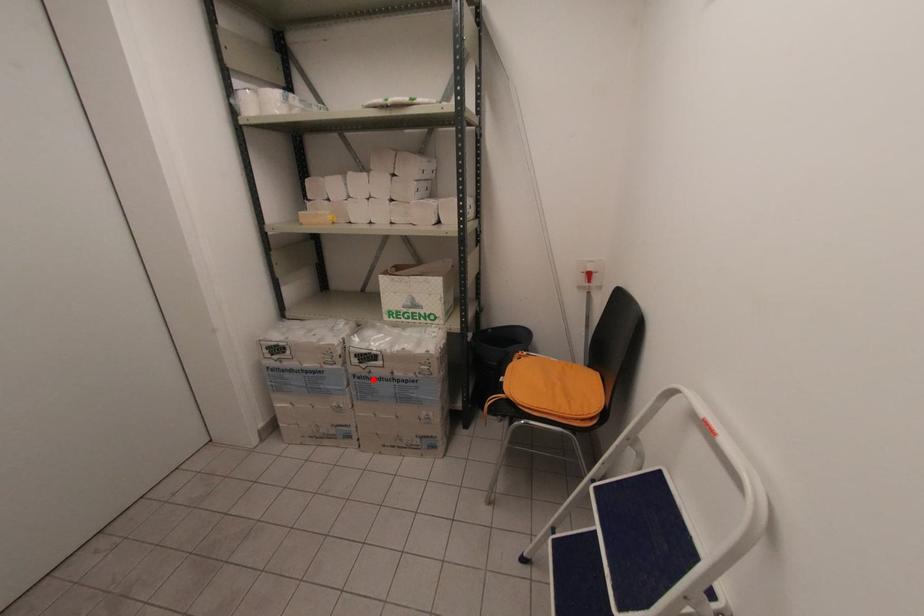
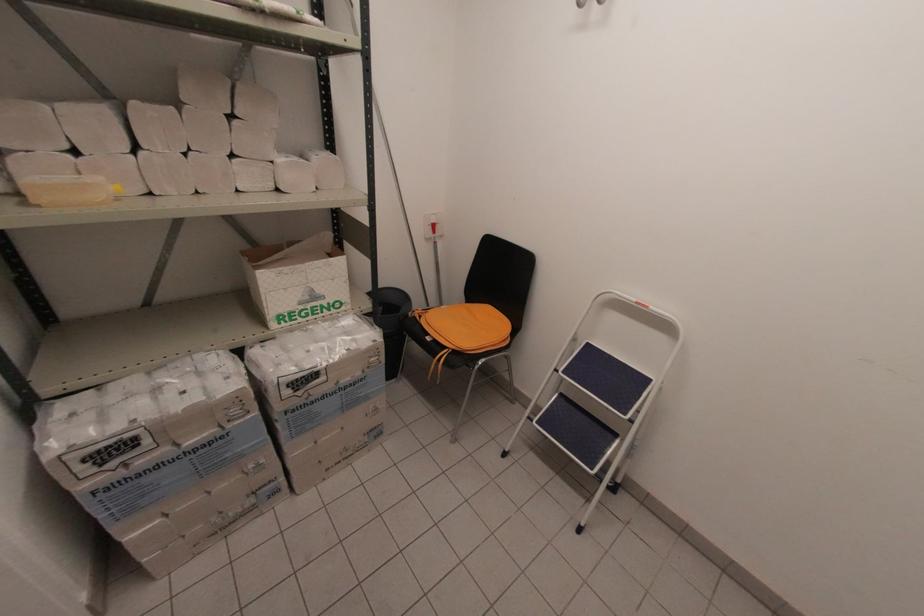
Question: I am providing you with two images of the same scene from different viewpoints. Given a red point in image1, look at the same physical point in image2. Is it:

Choices:
 (A) Closer to the viewpoint
 (B) Farther from the viewpoint

Answer: (A)